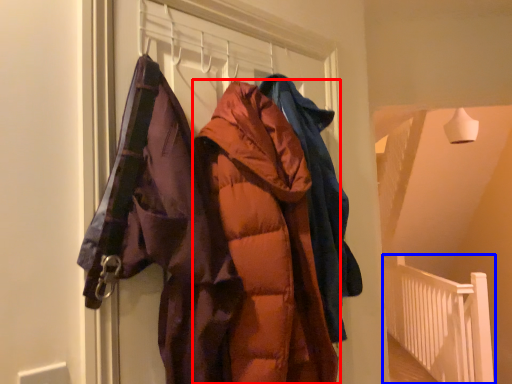
Question: Among these objects, which one is nearest to the camera, jacket (highlighted by a red box) or balustrade (highlighted by a blue box)?

Choices:
 (A) jacket
 (B) balustrade

Answer: (A)